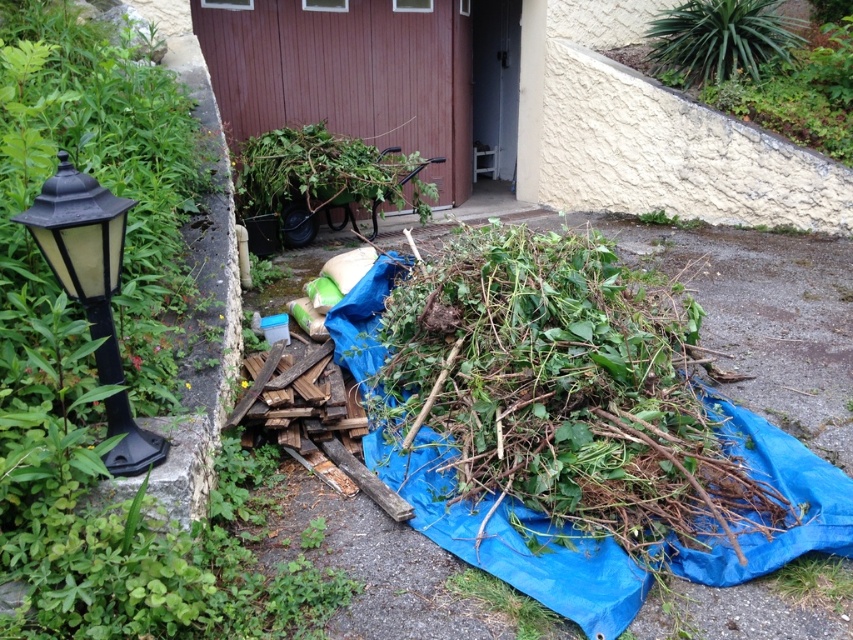
Question: Where is black plastic lamp post at left located in relation to green leafy plant at upper right in the image?

Choices:
 (A) below
 (B) above

Answer: (A)

Question: Which object is closer to the camera taking this photo?

Choices:
 (A) black plastic lamp post at left
 (B) green leafy plant at center
 (C) green leafy plant at upper right
 (D) brown wooden wheelbarrow at center

Answer: (A)

Question: Does brown wooden wheelbarrow at center lie behind green leafy plant at center?

Choices:
 (A) yes
 (B) no

Answer: (A)

Question: Which object appears closest to the camera in this image?

Choices:
 (A) green leafy plant at upper right
 (B) brown wooden wheelbarrow at center

Answer: (B)

Question: Which of the following is the farthest from the observer?

Choices:
 (A) green leafy plant at upper right
 (B) black plastic lamp post at left
 (C) brown wooden wheelbarrow at center
 (D) green leafy plant at center

Answer: (A)

Question: Can you confirm if black plastic lamp post at left is positioned to the right of green leafy plant at upper right?

Choices:
 (A) no
 (B) yes

Answer: (A)